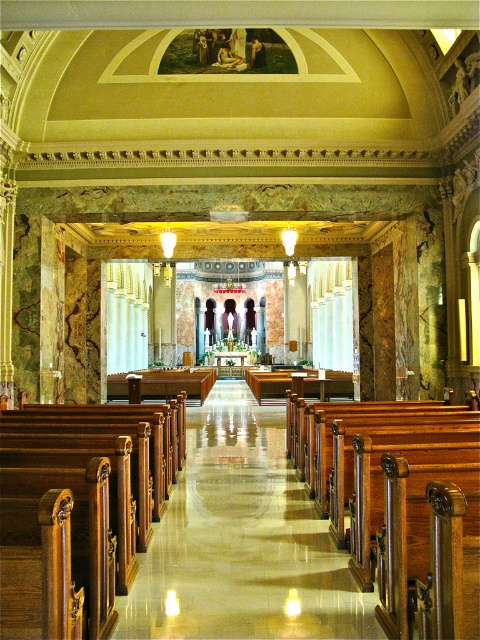
Question: Can you confirm if polished wood aisle at center is thinner than polished wood pews at center?

Choices:
 (A) yes
 (B) no

Answer: (A)

Question: Which point is farther to the camera?

Choices:
 (A) (334, 504)
 (B) (99, 413)
 (C) (305, 589)

Answer: (B)

Question: Does polished wood pews at center have a smaller size compared to polished wood church bench at center?

Choices:
 (A) yes
 (B) no

Answer: (A)

Question: Which point is farther to the camera?

Choices:
 (A) polished wood aisle at center
 (B) polished wood church bench at center
 (C) polished wood pews at center

Answer: (A)

Question: Which point is closer to the camera?

Choices:
 (A) polished wood church bench at center
 (B) polished wood pews at center
 (C) polished wood aisle at center

Answer: (B)

Question: Does polished wood pews at center have a larger size compared to polished wood church bench at center?

Choices:
 (A) no
 (B) yes

Answer: (A)